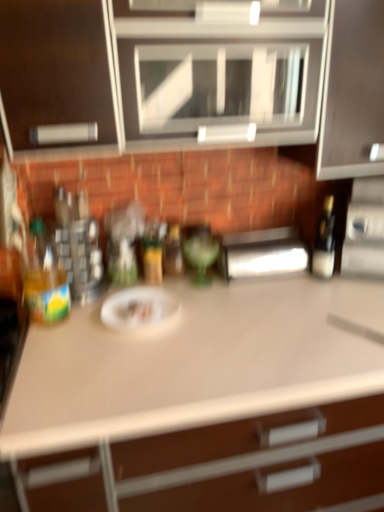
Question: From the image's perspective, is satin silver toaster at right, which ranks as the 2th appliance in left-to-right order, positioned above or below matte white cabinet at upper center?

Choices:
 (A) above
 (B) below

Answer: (B)

Question: Is satin silver toaster at right, which ranks as the 2th appliance in left-to-right order, in front of or behind matte white cabinet at upper center in the image?

Choices:
 (A) front
 (B) behind

Answer: (B)

Question: Which object is positioned closest to the translucent plastic bottle at left, positioned as the 1th bottle in left-to-right order?

Choices:
 (A) green glass bottle at center, which appears as the 3th bottle when viewed from the left
 (B) white matte countertop at center
 (C) satin silver toaster at right, which ranks as the 2th appliance in left-to-right order
 (D) white matte paper plate at center
 (E) matte black bottle at right, positioned as the fourth bottle in left-to-right order

Answer: (D)

Question: Considering the real-world distances, which object is closest to the translucent plastic bottle at left, which appears as the 4th bottle when viewed from the right?

Choices:
 (A) matte white cabinet at upper center
 (B) translucent glass bottle at center, which is counted as the 3th bottle, starting from the right
 (C) white matte paper plate at center
 (D) satin silver toaster at right, which ranks as the 2th appliance in left-to-right order
 (E) white matte countertop at center

Answer: (C)